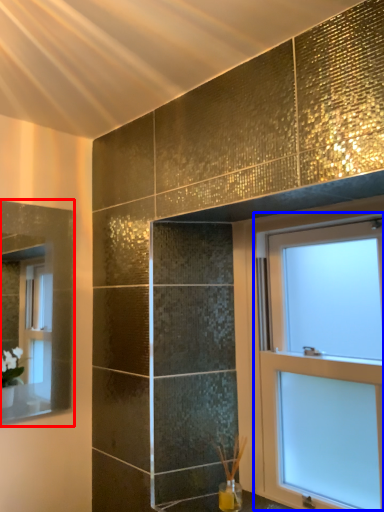
Question: Which point is closer to the camera, mirror (highlighted by a red box) or window (highlighted by a blue box)?

Choices:
 (A) mirror
 (B) window

Answer: (B)